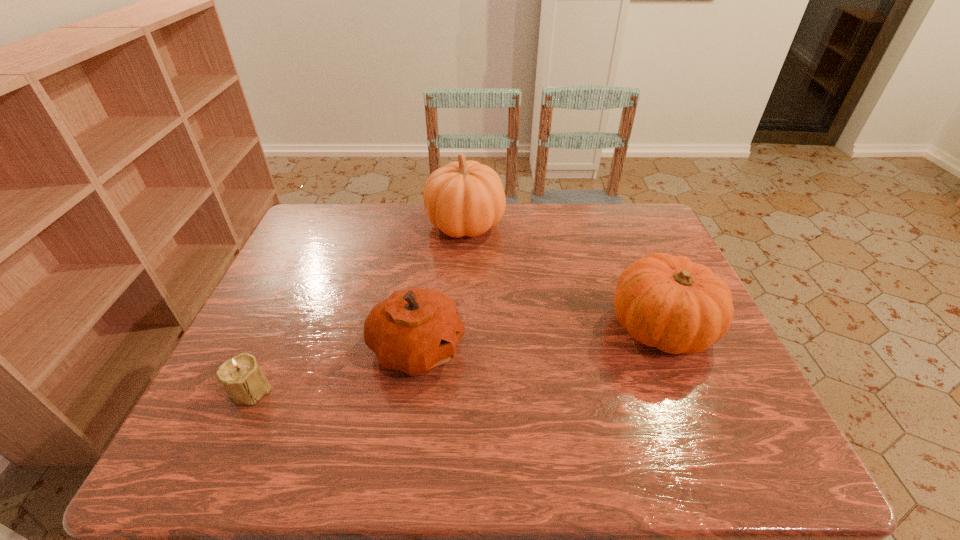
The height and width of the screenshot is (540, 960). I want to click on object situated at the right edge, so click(x=663, y=301).

In the image, there is a desktop. Where is `vacant space at the far edge`? This screenshot has width=960, height=540. vacant space at the far edge is located at coordinates (354, 243).

In the image, there is a desktop. Where is `vacant space at the near edge`? vacant space at the near edge is located at coordinates (471, 465).

I want to click on free region at the left edge of the desktop, so click(295, 284).

At what (x,y) coordinates should I click in order to perform the action: click on vacant space at the right edge of the desktop. Please return your answer as a coordinate pair (x, y). The height and width of the screenshot is (540, 960). Looking at the image, I should click on (722, 414).

Locate an element on the screen. This screenshot has height=540, width=960. free point at the far left corner is located at coordinates (350, 226).

Image resolution: width=960 pixels, height=540 pixels. In the image, there is a desktop. What are the coordinates of `vacant space at the far right corner` in the screenshot? It's located at (645, 244).

You are a GUI agent. You are given a task and a screenshot of the screen. Output one action in this format:
    pyautogui.click(x=<x>, y=<y>)
    Task: Click on the free space between the rightmost pumpkin and the tallest pumpkin
    
    Given the screenshot: What is the action you would take?
    pyautogui.click(x=563, y=276)

Where is `vacant point located between the leftmost object and the farthest pumpkin`? vacant point located between the leftmost object and the farthest pumpkin is located at coordinates (358, 307).

Image resolution: width=960 pixels, height=540 pixels. I want to click on free space between the rightmost object and the shortest object, so click(456, 357).